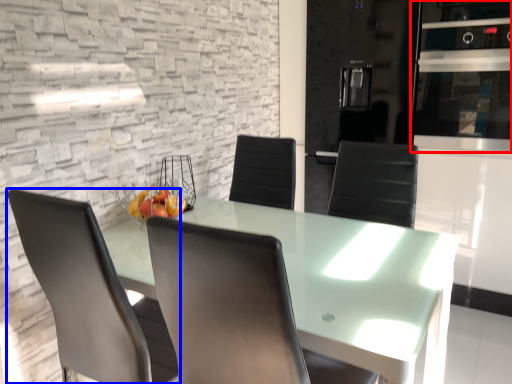
Question: Which object is further to the camera taking this photo, appliance (highlighted by a red box) or chair (highlighted by a blue box)?

Choices:
 (A) appliance
 (B) chair

Answer: (A)